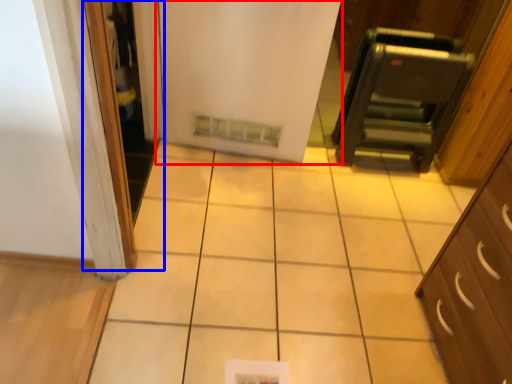
Question: Among these objects, which one is farthest to the camera, door (highlighted by a red box) or screen door (highlighted by a blue box)?

Choices:
 (A) door
 (B) screen door

Answer: (A)